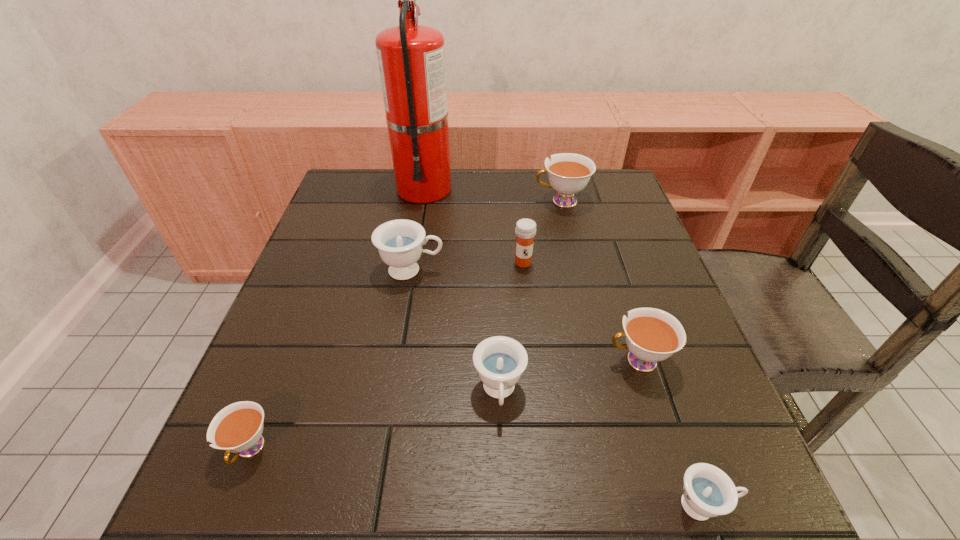
Where is `object located in the far right corner section of the desktop`? Image resolution: width=960 pixels, height=540 pixels. object located in the far right corner section of the desktop is located at coordinates (568, 173).

In order to click on object that is at the near right corner in this screenshot , I will do `click(708, 492)`.

You are a GUI agent. You are given a task and a screenshot of the screen. Output one action in this format:
    pyautogui.click(x=<x>, y=<y>)
    Task: Click on the free space at the far edge of the desktop
    The width and height of the screenshot is (960, 540).
    Given the screenshot: What is the action you would take?
    pyautogui.click(x=510, y=212)

In the image, there is a desktop. Find the location of `vacant space at the near edge`. vacant space at the near edge is located at coordinates (655, 514).

Locate an element on the screen. This screenshot has width=960, height=540. vacant space at the left edge of the desktop is located at coordinates (279, 308).

Find the location of a particular element. The image size is (960, 540). free space at the right edge of the desktop is located at coordinates (619, 273).

You are a GUI agent. You are given a task and a screenshot of the screen. Output one action in this format:
    pyautogui.click(x=<x>, y=<y>)
    Task: Click on the vacant area at the far left corner
    Image resolution: width=960 pixels, height=540 pixels.
    Given the screenshot: What is the action you would take?
    click(x=388, y=180)

In the image, there is a desktop. Where is `blank space at the near right corner`? blank space at the near right corner is located at coordinates (679, 517).

Where is `blank region between the farthest teacup and the leftmost blue teacup`? The width and height of the screenshot is (960, 540). blank region between the farthest teacup and the leftmost blue teacup is located at coordinates (487, 235).

At what (x,y) coordinates should I click in order to perform the action: click on unoccupied area between the farthest teacup and the second biggest blue teacup. Please return your answer as a coordinate pair (x, y). This screenshot has height=540, width=960. Looking at the image, I should click on (530, 296).